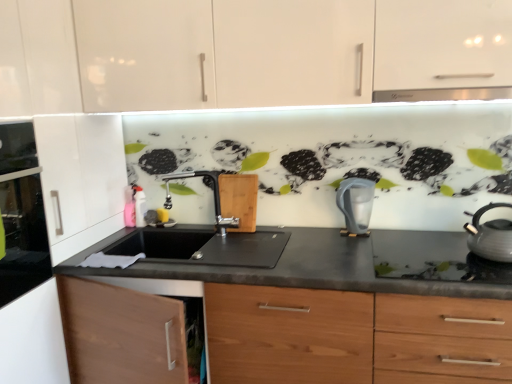
Where is `empty space that is in between white glossy gas stove at right and satin nickel faucet at center`? This screenshot has width=512, height=384. empty space that is in between white glossy gas stove at right and satin nickel faucet at center is located at coordinates (282, 243).